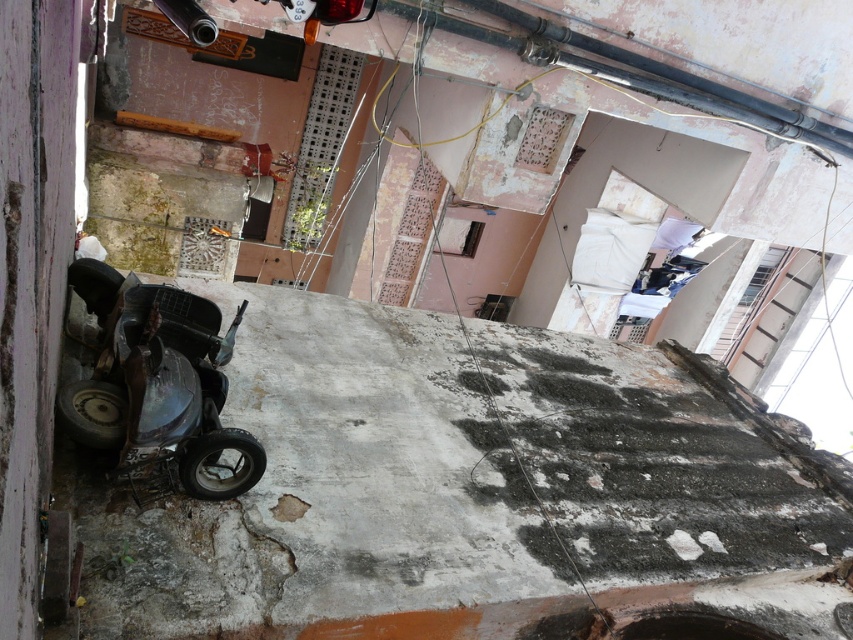
Between gray concrete at lower left and metallic matte mower at lower left, which one has more height?

With more height is gray concrete at lower left.

Can you confirm if gray concrete at lower left is shorter than metallic matte mower at lower left?

No.

Describe the element at coordinates (444, 486) in the screenshot. I see `gray concrete at lower left` at that location.

The width and height of the screenshot is (853, 640). What are the coordinates of `gray concrete at lower left` in the screenshot? It's located at coord(444,486).